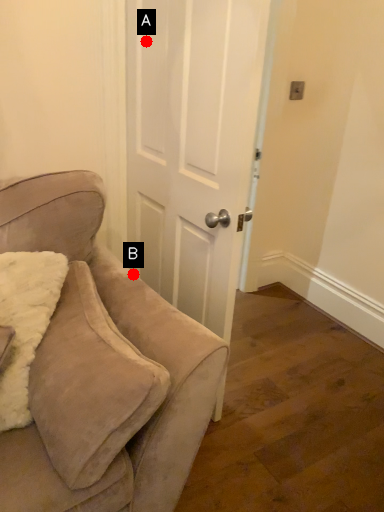
Question: Two points are circled on the image, labeled by A and B beside each circle. Which point is closer to the camera?

Choices:
 (A) A is closer
 (B) B is closer

Answer: (B)